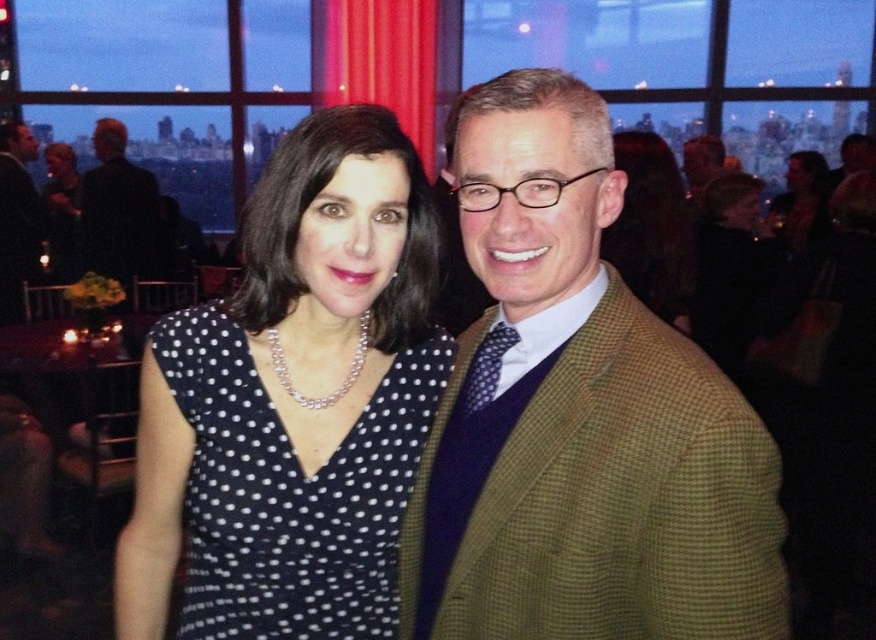
Does black dotted fabric dress at center have a lesser height compared to black wool suit at left?

Correct, black dotted fabric dress at center is not as tall as black wool suit at left.

Does black dotted fabric dress at center appear over black wool suit at left?

Actually, black dotted fabric dress at center is below black wool suit at left.

Between point (185, 419) and point (104, 166), which one is positioned behind?

The point (104, 166) is more distant.

Find the location of a particular element. black dotted fabric dress at center is located at coordinates (290, 490).

Can you confirm if green checkered blazer at right is bigger than black dotted fabric dress at center?

Yes.

Describe the element at coordinates (578, 419) in the screenshot. I see `green checkered blazer at right` at that location.

Locate an element on the screen. green checkered blazer at right is located at coordinates (578, 419).

Is green checkered blazer at right further to camera compared to black wool suit at left?

No, green checkered blazer at right is closer to the viewer.

Consider the image. Between green checkered blazer at right and black wool suit at left, which one appears on the right side from the viewer's perspective?

green checkered blazer at right is more to the right.

Find the location of `green checkered blazer at right`. green checkered blazer at right is located at coordinates (578, 419).

This screenshot has width=876, height=640. Find the location of `green checkered blazer at right`. green checkered blazer at right is located at coordinates (578, 419).